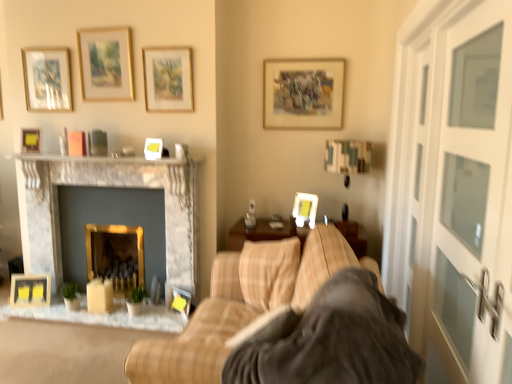
Locate an element on the screen. The width and height of the screenshot is (512, 384). vacant point above wooden picture frame at upper center, which is the second picture frame from right to left (from a real-world perspective) is located at coordinates (304, 51).